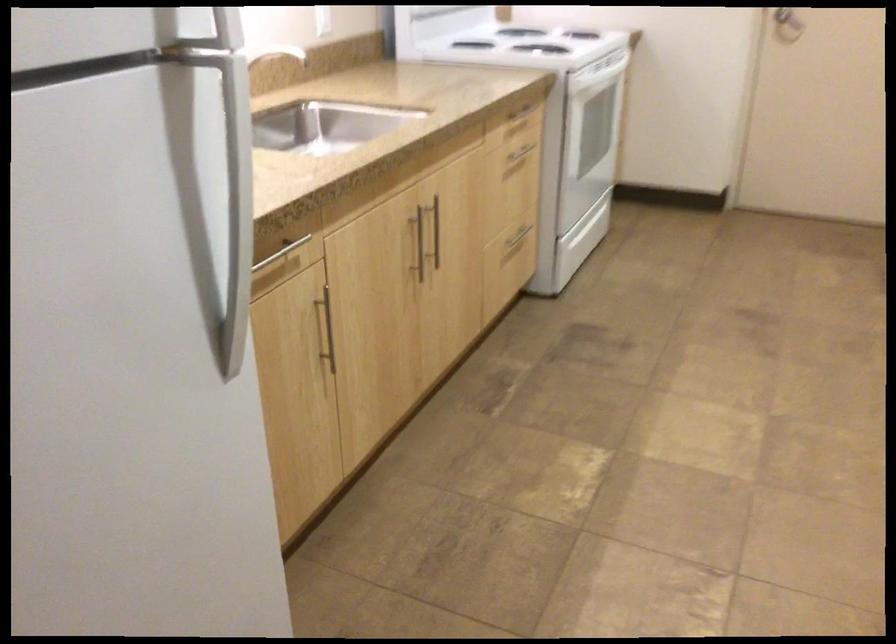
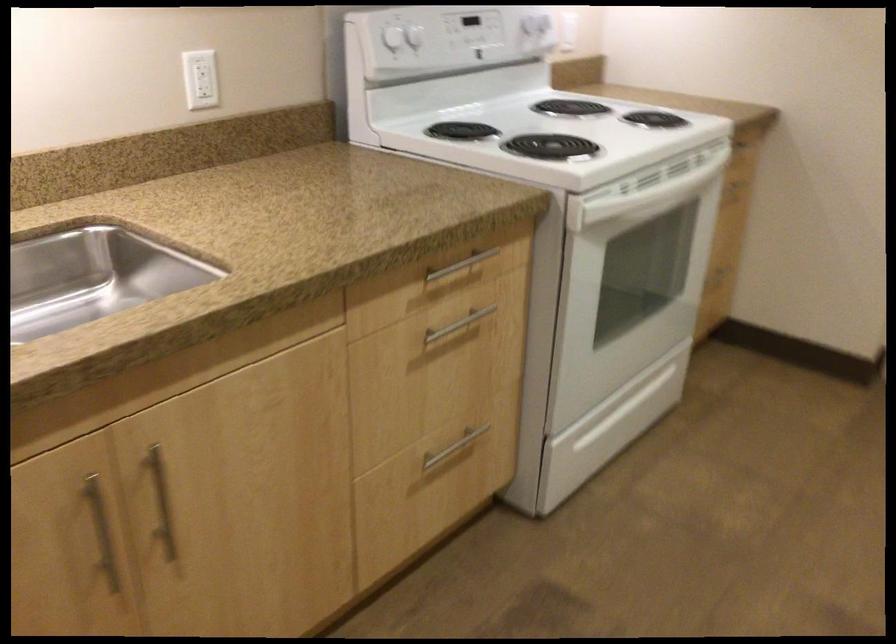
The point at (605, 67) is marked in the first image. Where is the corresponding point in the second image?

(645, 196)